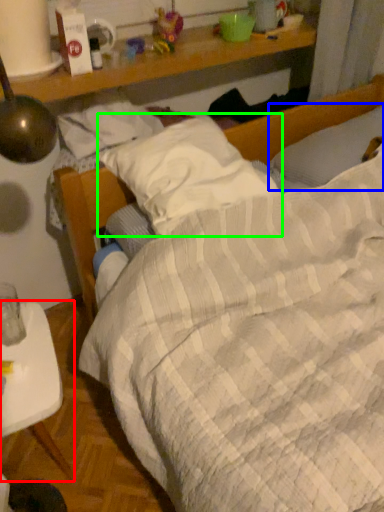
Question: Considering the real-world distances, which object is farthest from desk (highlighted by a red box)? pillow (highlighted by a blue box) or pillow (highlighted by a green box)?

Choices:
 (A) pillow
 (B) pillow

Answer: (A)